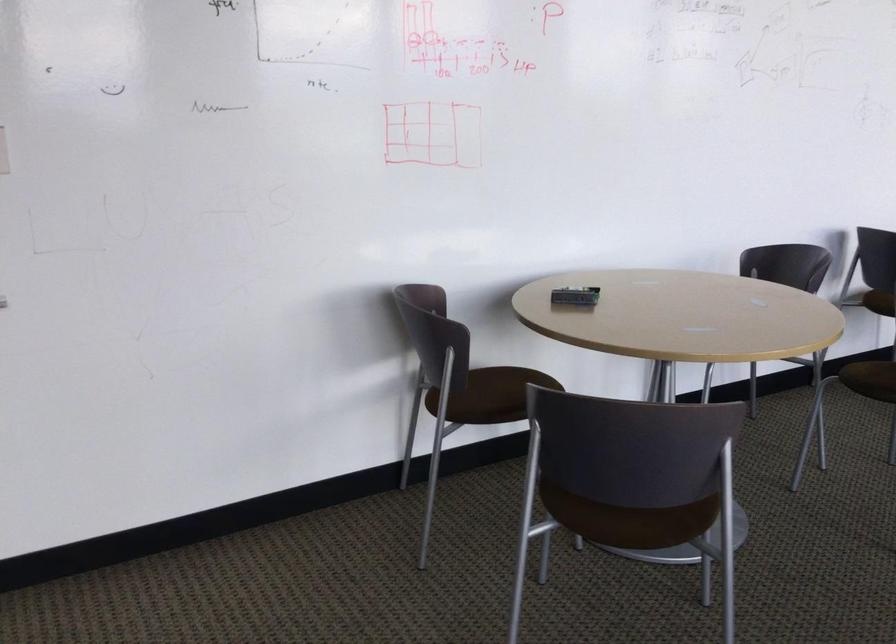
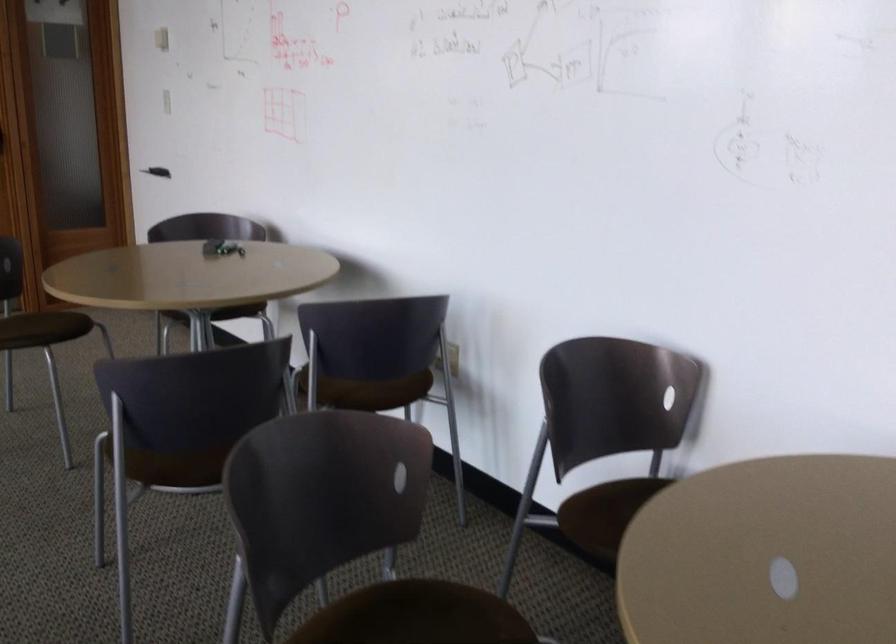
Locate, in the second image, the point that corresponds to point 590,305 in the first image.

(221, 248)